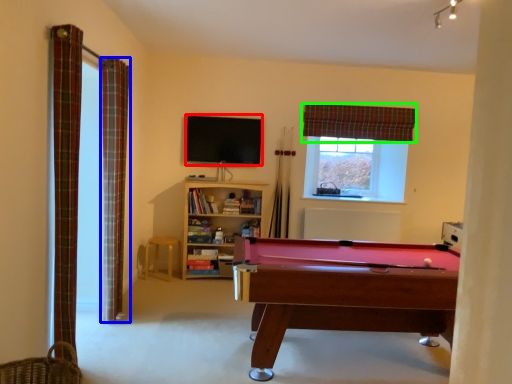
Question: Based on their relative distances, which object is nearer to billard (highlighted by a red box)? Choose from curtain (highlighted by a blue box) and curtain (highlighted by a green box).

Choices:
 (A) curtain
 (B) curtain

Answer: (B)